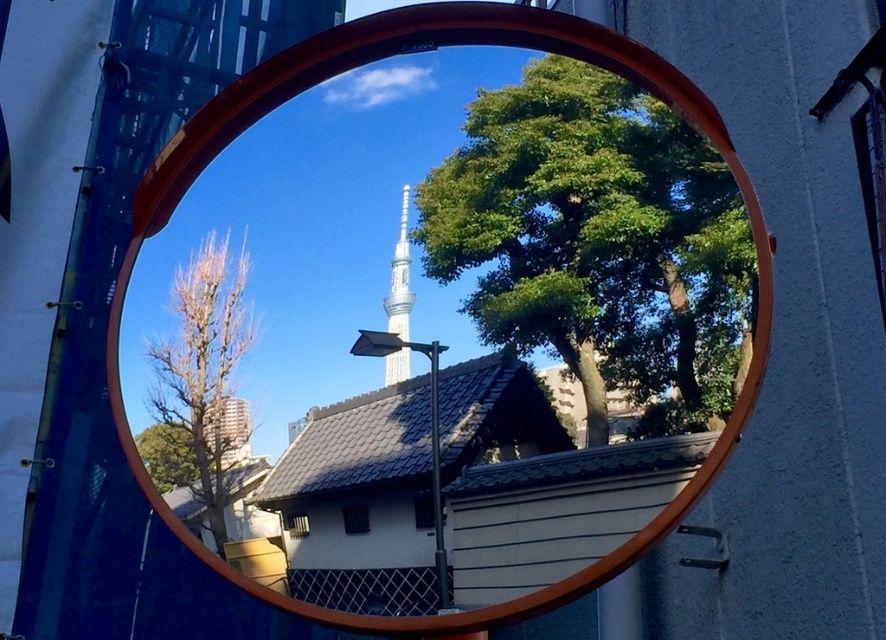
Does green leafy tree at upper center have a greater width compared to bare wood tree at left?

Yes, green leafy tree at upper center is wider than bare wood tree at left.

What do you see at coordinates (596, 241) in the screenshot? I see `green leafy tree at upper center` at bounding box center [596, 241].

The image size is (886, 640). What do you see at coordinates (596, 241) in the screenshot?
I see `green leafy tree at upper center` at bounding box center [596, 241].

The height and width of the screenshot is (640, 886). I want to click on green leafy tree at upper center, so click(x=596, y=241).

Is point (709, 115) positioned after point (390, 308)?

Yes, it is.

Which is behind, point (663, 100) or point (394, 266)?

The point (663, 100) is more distant.

Identify the location of smooth wooden mirror at center. Image resolution: width=886 pixels, height=640 pixels. (377, 60).

Can you confirm if smooth wooden mirror at center is bigger than bare wood tree at left?

Correct, smooth wooden mirror at center is larger in size than bare wood tree at left.

Between point (200, 164) and point (222, 292), which one is positioned in front?

Positioned in front is point (222, 292).

Find the location of a particular element. The height and width of the screenshot is (640, 886). smooth wooden mirror at center is located at coordinates (377, 60).